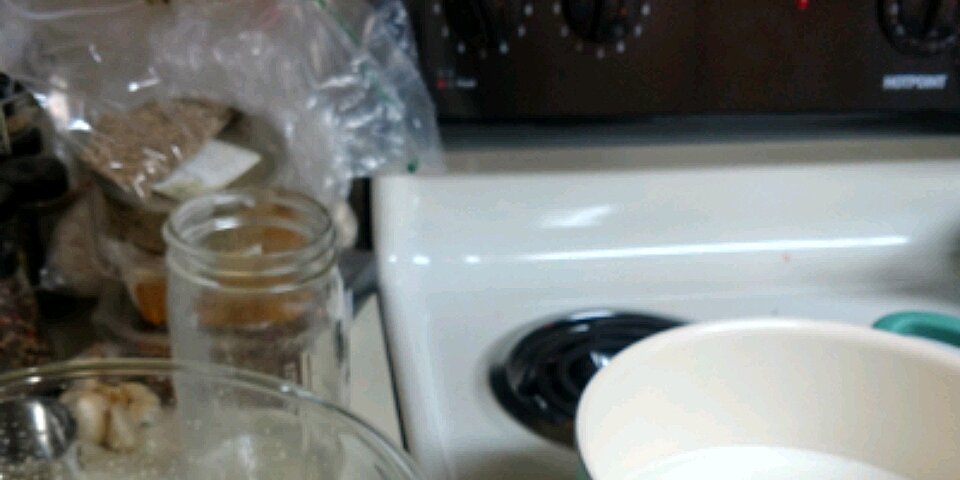
You are a GUI agent. You are given a task and a screenshot of the screen. Output one action in this format:
    pyautogui.click(x=<x>, y=<y>)
    Task: Click on the bowl
    This screenshot has width=960, height=480.
    Given the screenshot: What is the action you would take?
    pyautogui.click(x=160, y=448), pyautogui.click(x=772, y=411)